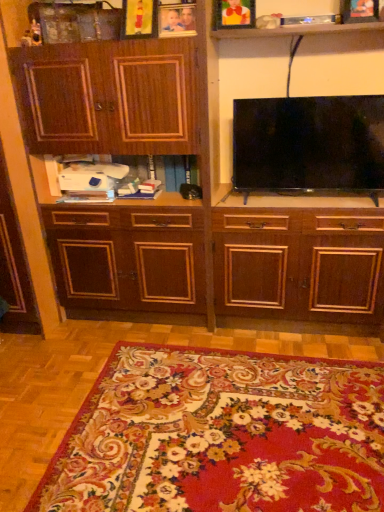
Question: From a real-world perspective, is wooden picture frame at upper center, which appears as the 3th picture frame when viewed from the left, located beneath black glossy flat-screen tv at upper center?

Choices:
 (A) yes
 (B) no

Answer: (B)

Question: Is wooden picture frame at upper center, the second picture frame in the right-to-left sequence, oriented towards black glossy flat-screen tv at upper center?

Choices:
 (A) yes
 (B) no

Answer: (B)

Question: Is wooden picture frame at upper center, the second picture frame in the right-to-left sequence, positioned behind black glossy flat-screen tv at upper center?

Choices:
 (A) yes
 (B) no

Answer: (A)

Question: Considering the relative positions of wooden picture frame at upper center, the second picture frame in the right-to-left sequence, and black glossy flat-screen tv at upper center in the image provided, is wooden picture frame at upper center, the second picture frame in the right-to-left sequence, to the right of black glossy flat-screen tv at upper center from the viewer's perspective?

Choices:
 (A) no
 (B) yes

Answer: (A)

Question: Is wooden picture frame at upper center, which appears as the 3th picture frame when viewed from the left, outside of black glossy flat-screen tv at upper center?

Choices:
 (A) no
 (B) yes

Answer: (B)

Question: Is black glossy flat-screen tv at upper center bigger or smaller than floral carpet at lower center?

Choices:
 (A) small
 (B) big

Answer: (A)

Question: Considering their positions, is black glossy flat-screen tv at upper center located in front of or behind floral carpet at lower center?

Choices:
 (A) front
 (B) behind

Answer: (B)

Question: Is black glossy flat-screen tv at upper center inside the boundaries of floral carpet at lower center, or outside?

Choices:
 (A) inside
 (B) outside

Answer: (B)

Question: Looking at their shapes, would you say black glossy flat-screen tv at upper center is wider or thinner than floral carpet at lower center?

Choices:
 (A) wide
 (B) thin

Answer: (B)

Question: Is wooden picture frame at upper center, positioned as the 4th picture frame in right-to-left order, wider or thinner than wooden picture frame at upper right, positioned as the fourth picture frame in left-to-right order?

Choices:
 (A) wide
 (B) thin

Answer: (A)

Question: Based on their sizes in the image, would you say wooden picture frame at upper center, which is the 1th picture frame in left-to-right order, is bigger or smaller than wooden picture frame at upper right, the 1th picture frame positioned from the right?

Choices:
 (A) big
 (B) small

Answer: (A)

Question: From a real-world perspective, relative to wooden picture frame at upper right, positioned as the fourth picture frame in left-to-right order, is wooden picture frame at upper center, which is the 1th picture frame in left-to-right order, vertically above or below?

Choices:
 (A) below
 (B) above

Answer: (B)

Question: Is wooden picture frame at upper center, positioned as the 4th picture frame in right-to-left order, in front of or behind wooden picture frame at upper right, the 1th picture frame positioned from the right, in the image?

Choices:
 (A) behind
 (B) front

Answer: (A)

Question: Is wooden picture frame at upper right, positioned as the fourth picture frame in left-to-right order, bigger or smaller than dark wood cabinet at center?

Choices:
 (A) small
 (B) big

Answer: (A)

Question: From a real-world perspective, is wooden picture frame at upper right, the 1th picture frame positioned from the right, positioned above or below dark wood cabinet at center?

Choices:
 (A) above
 (B) below

Answer: (A)